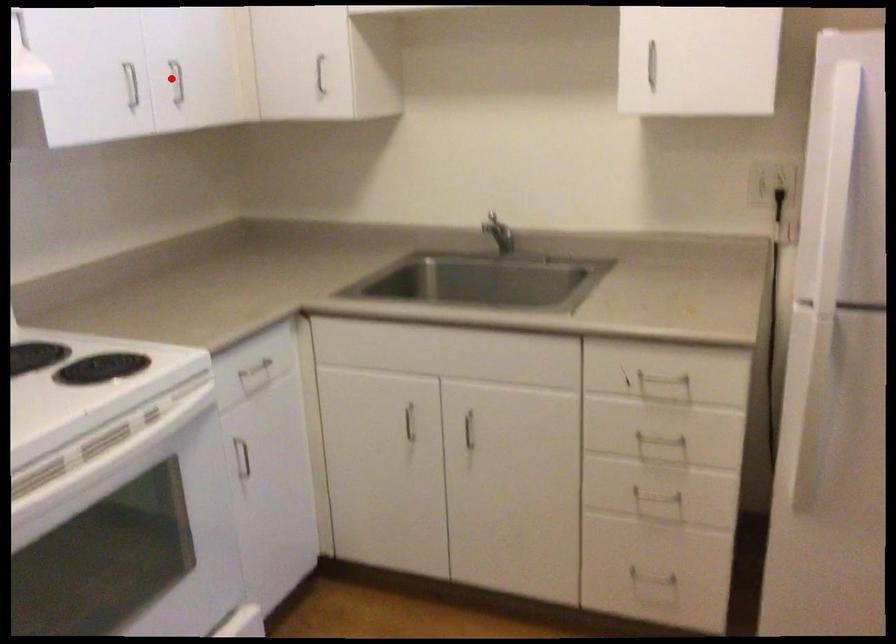
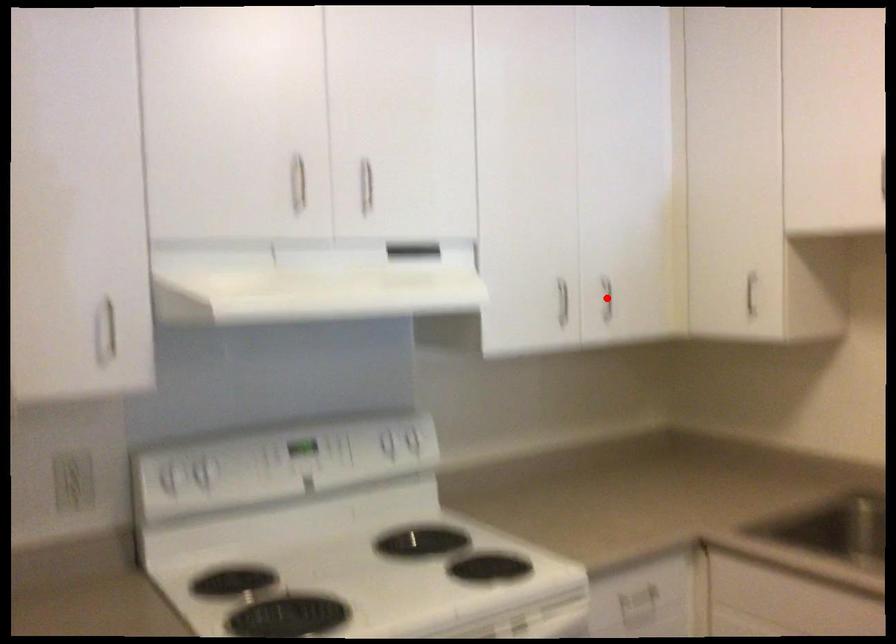
I am providing you with two images of the same scene from different viewpoints. A red point is marked on the first image and another point is marked on the second image. Is the marked point in image1 the same physical position as the marked point in image2?

Yes